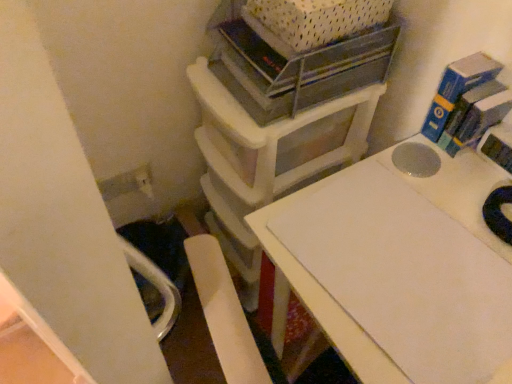
Question: From the image's perspective, relative to white plastic storage unit at upper center, is white plastic crate at upper center above or below?

Choices:
 (A) above
 (B) below

Answer: (A)

Question: Does point (305, 31) appear closer or farther from the camera than point (210, 230)?

Choices:
 (A) farther
 (B) closer

Answer: (B)

Question: Which is nearer to the white plastic crate at upper center?

Choices:
 (A) metallic gray shelf at upper center
 (B) white plastic storage unit at upper center
 (C) white matte table at center

Answer: (A)

Question: Which of these objects is positioned farthest from the metallic gray shelf at upper center?

Choices:
 (A) white plastic storage unit at upper center
 (B) white plastic crate at upper center
 (C) white matte table at center

Answer: (C)